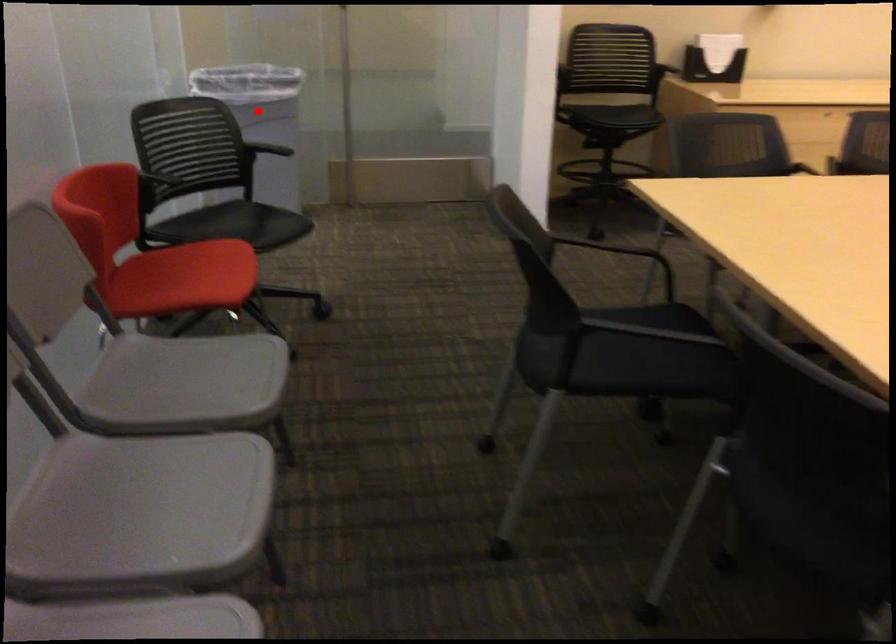
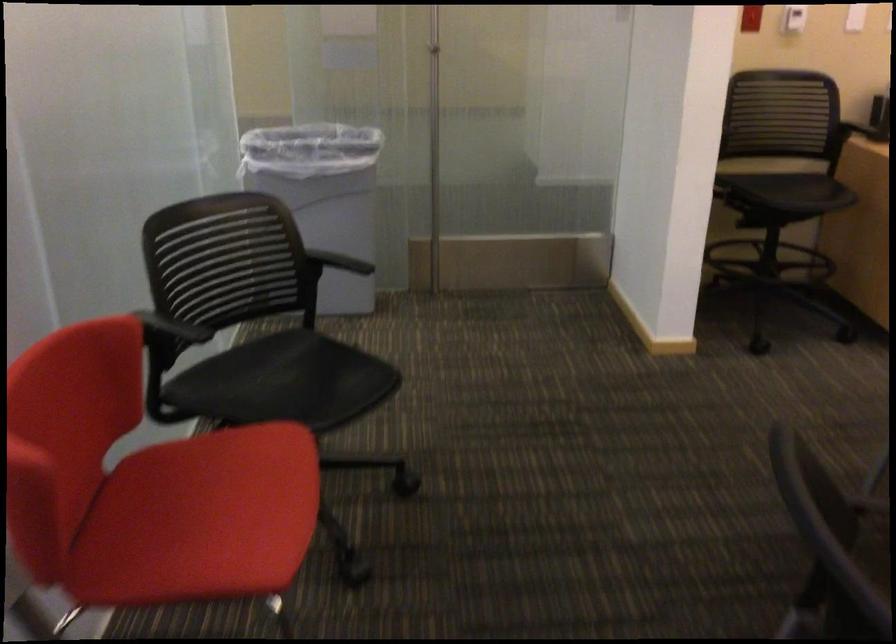
Question: I am providing you with two images of the same scene from different viewpoints. Image1 has a red point marked. In image2, the corresponding 3D location appears at what relative position? Reply with the corresponding letter.

Choices:
 (A) Closer
 (B) Farther

Answer: (A)